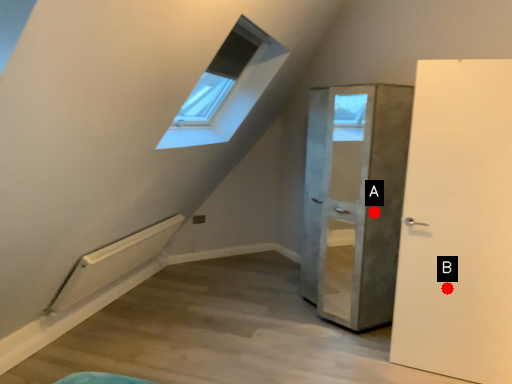
Question: Two points are circled on the image, labeled by A and B beside each circle. Which point is farther to the camera?

Choices:
 (A) A is further
 (B) B is further

Answer: (A)